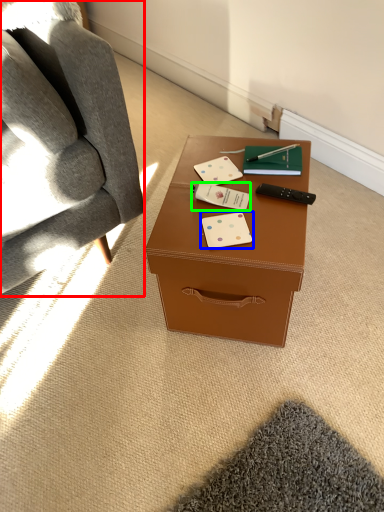
Question: Which is farther away from chair (highlighted by a red box)? business card (highlighted by a blue box) or business card (highlighted by a green box)?

Choices:
 (A) business card
 (B) business card

Answer: (A)